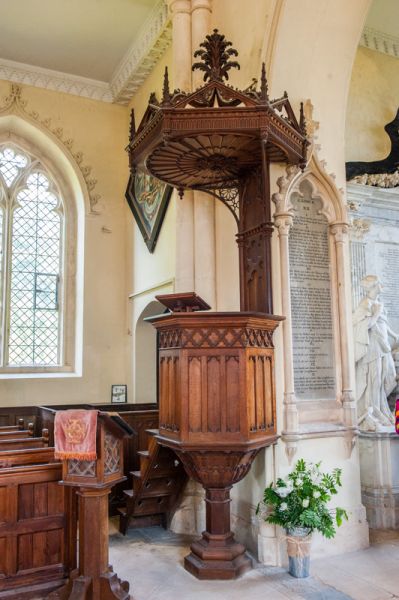
Find the location of a particular element. towel is located at coordinates (87, 443).